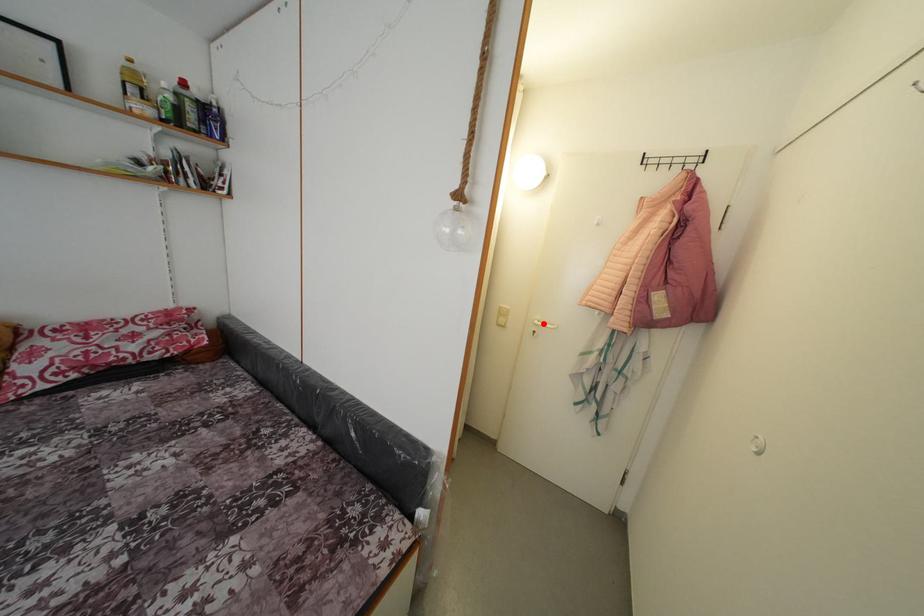
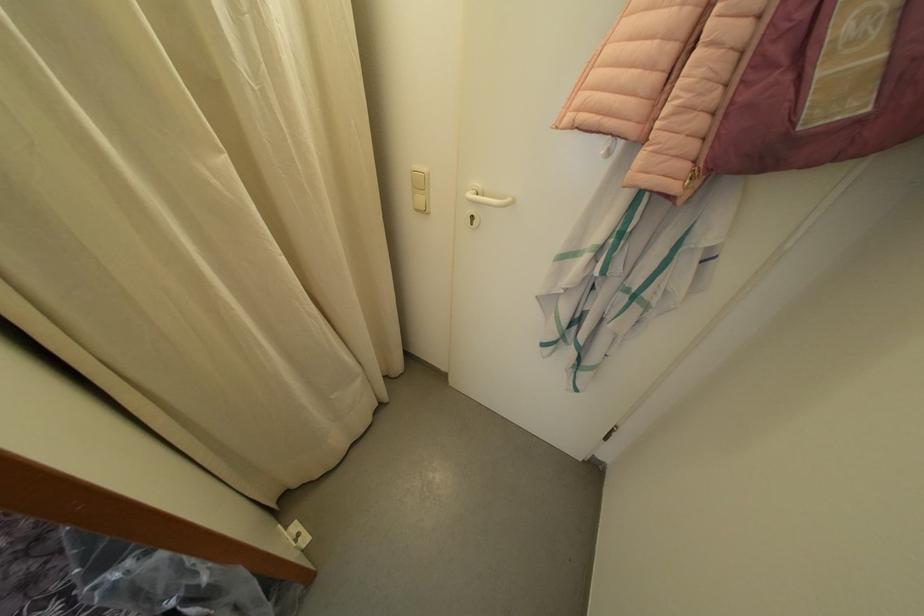
Locate, in the second image, the point that corresponds to the highlighted location in the first image.

(482, 190)